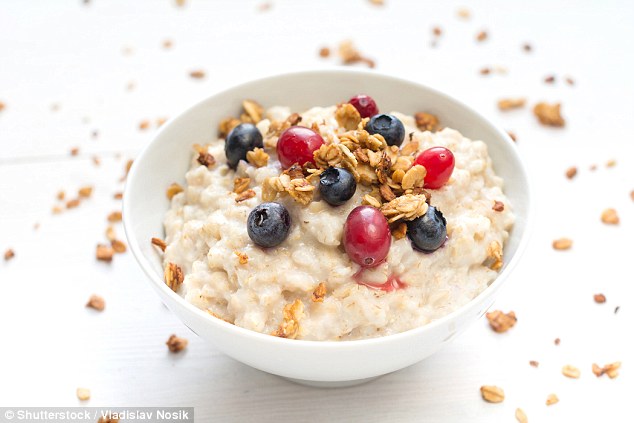
Locate an element on the screen. Image resolution: width=634 pixels, height=423 pixels. bowl is located at coordinates (151, 180).